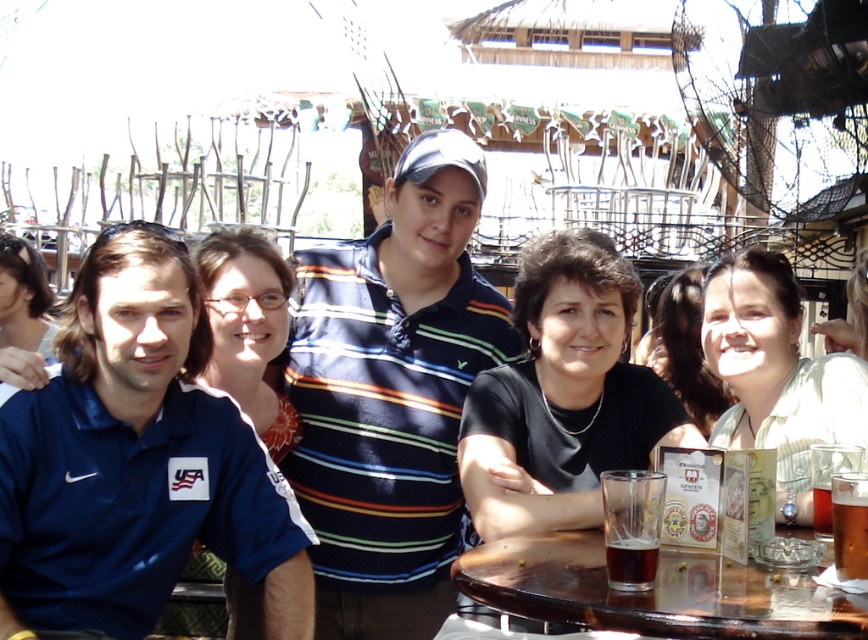
You are a photographer standing at the edge of the outdoor seating area. You want to take a photo that includes both the blue cotton polo shirt at center and the brown glass at table right. Given the distance between them, will you need to adjust your camera to focus on both subjects simultaneously?

The distance between the blue cotton polo shirt at center and the brown glass at table right is 12.63 meters. Since the subjects are far apart, you may need to adjust your camera settings to ensure both are in focus, possibly using a smaller aperture for a deeper depth of field.

Looking at this image, you are a photographer setting up for a group photo. You notice two shirts in the scene, the striped cotton shirt at center and the matte blue shirt at left. Which shirt should you adjust to ensure both shirts are of equal width in the photo?

The striped cotton shirt at center has a lesser width compared to matte blue shirt at left, so you should adjust the striped cotton shirt at center to make it wider to match the width of the matte blue shirt at left.